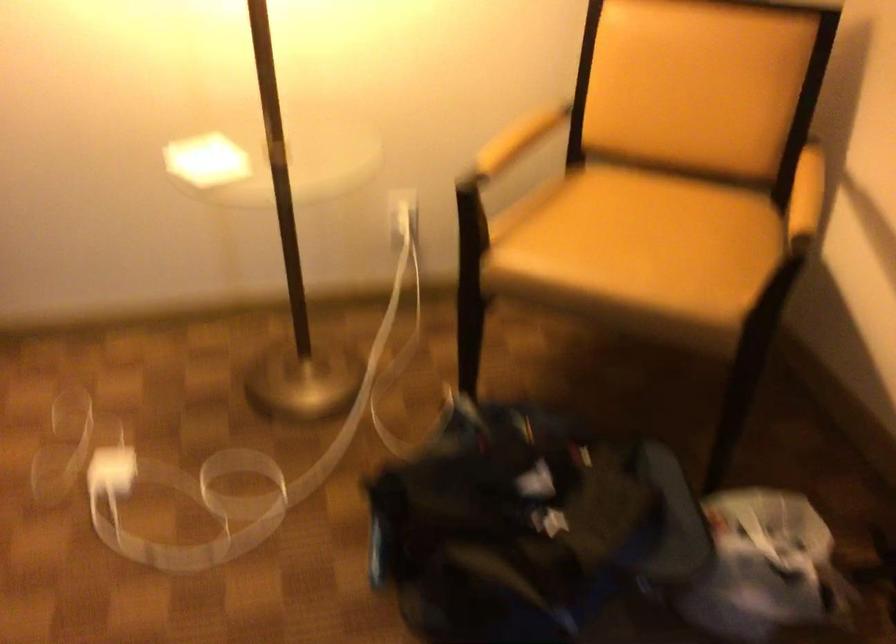
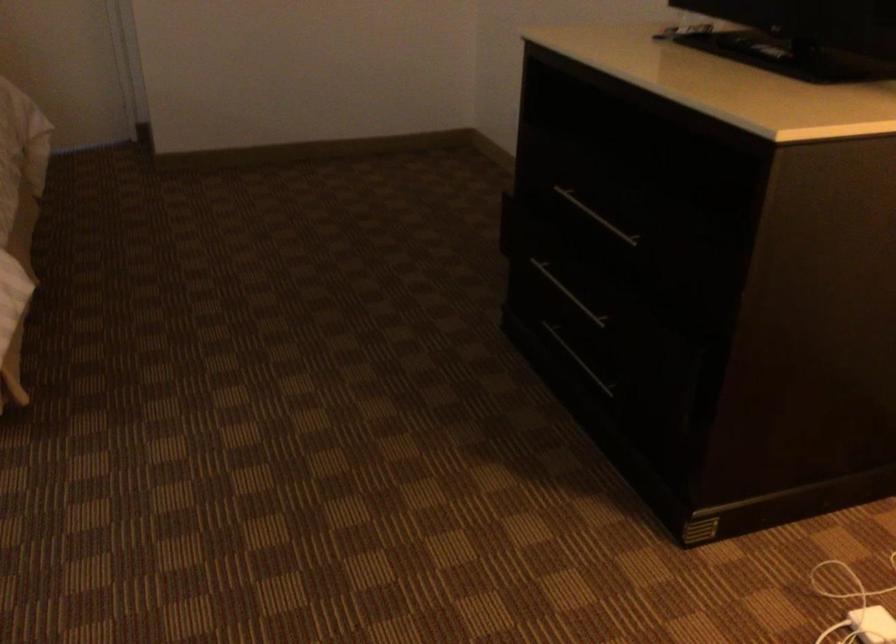
The first image is from the beginning of the video and the second image is from the end. How did the camera likely rotate when shooting the video?

The camera rotated toward left-down.